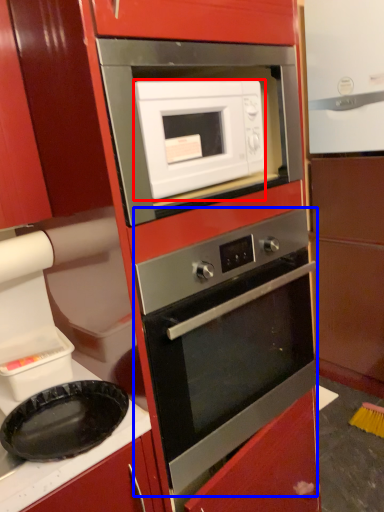
Question: Which point is further to the camera, microwave oven (highlighted by a red box) or oven (highlighted by a blue box)?

Choices:
 (A) microwave oven
 (B) oven

Answer: (A)